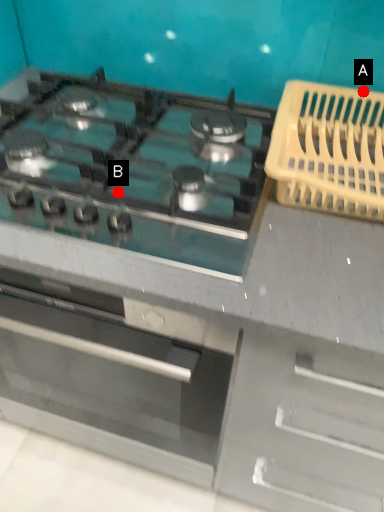
Question: Two points are circled on the image, labeled by A and B beside each circle. Which point is further to the camera?

Choices:
 (A) A is further
 (B) B is further

Answer: (A)